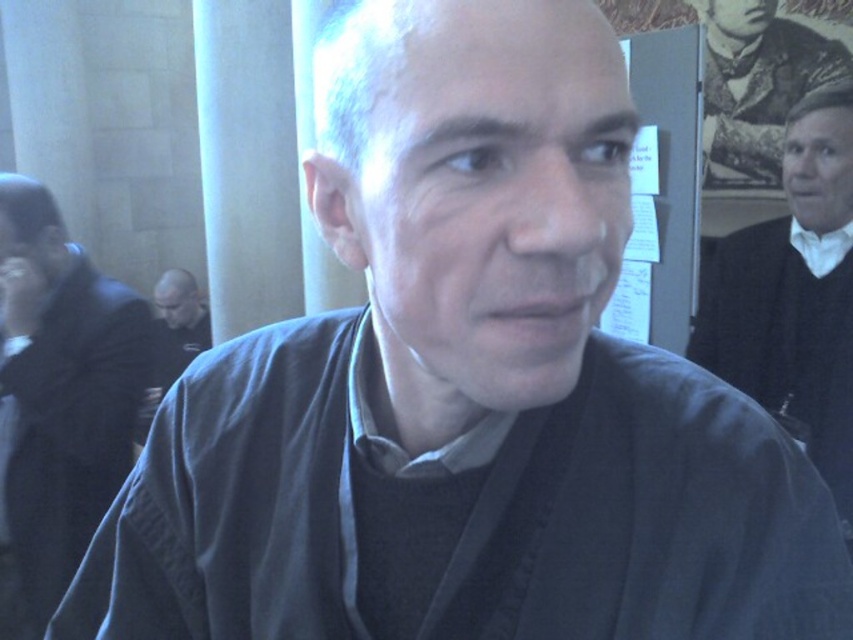
Does dark gray sweater at center appear over white cotton shirt at upper right?

Actually, dark gray sweater at center is below white cotton shirt at upper right.

Is dark gray sweater at center thinner than white cotton shirt at upper right?

No, dark gray sweater at center is not thinner than white cotton shirt at upper right.

The height and width of the screenshot is (640, 853). Describe the element at coordinates (172, 339) in the screenshot. I see `dark gray sweater at center` at that location.

The width and height of the screenshot is (853, 640). I want to click on dark gray sweater at center, so click(172, 339).

Looking at this image, can you confirm if dark gray fabric at center is taller than dark gray sweater at right?

Correct, dark gray fabric at center is much taller as dark gray sweater at right.

Is dark gray fabric at center below dark gray sweater at right?

Yes.

In order to click on dark gray fabric at center in this screenshot , I will do `click(59, 394)`.

Between dark gray sweater at right and dark gray sweater at center, which one has less height?

dark gray sweater at center

Can you confirm if dark gray sweater at right is positioned below dark gray sweater at center?

No, dark gray sweater at right is not below dark gray sweater at center.

Who is more forward, (839, 156) or (141, 426)?

Point (839, 156) is in front.

This screenshot has height=640, width=853. Find the location of `dark gray sweater at right`. dark gray sweater at right is located at coordinates (793, 294).